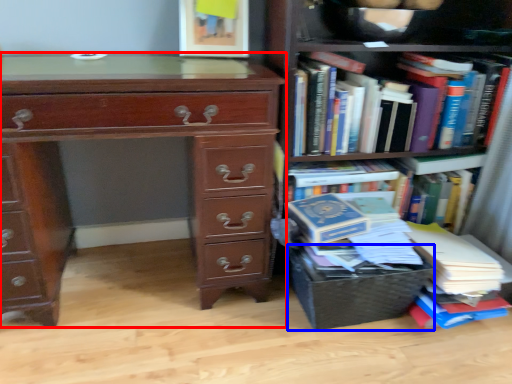
Question: Among these objects, which one is nearest to the camera, chest of drawers (highlighted by a red box) or crate (highlighted by a blue box)?

Choices:
 (A) chest of drawers
 (B) crate

Answer: (A)